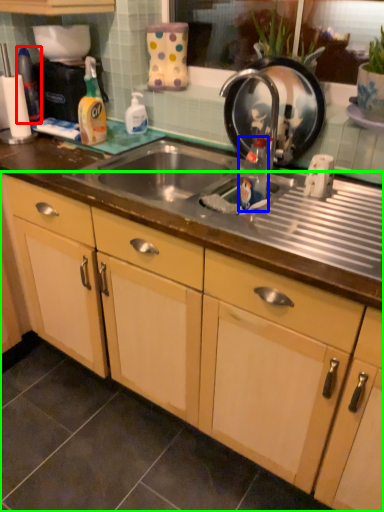
Question: Considering the real-world distances, which object is farthest from bottle (highlighted by a red box)? bottle (highlighted by a blue box) or cabinetry (highlighted by a green box)?

Choices:
 (A) bottle
 (B) cabinetry

Answer: (B)